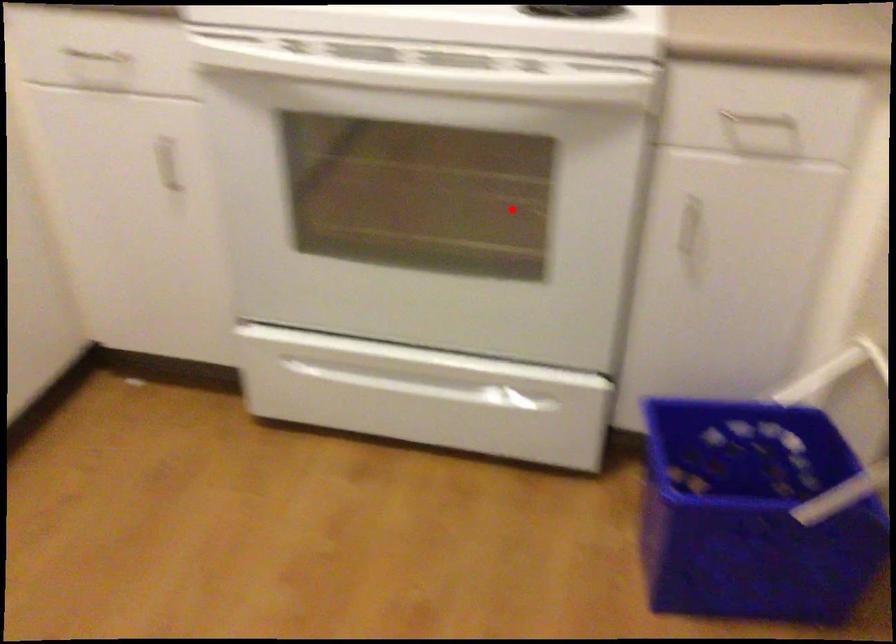
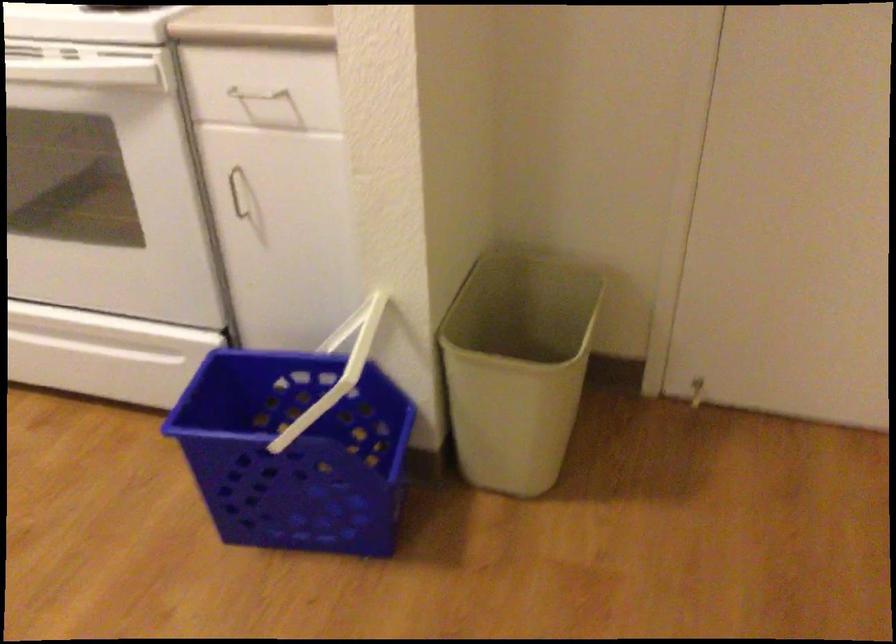
Question: A red point is marked in image1. In image2, is the corresponding 3D point closer to the camera or farther? Reply with the corresponding letter.

Choices:
 (A) The corresponding 3D point is closer.
 (B) The corresponding 3D point is farther.

Answer: (B)